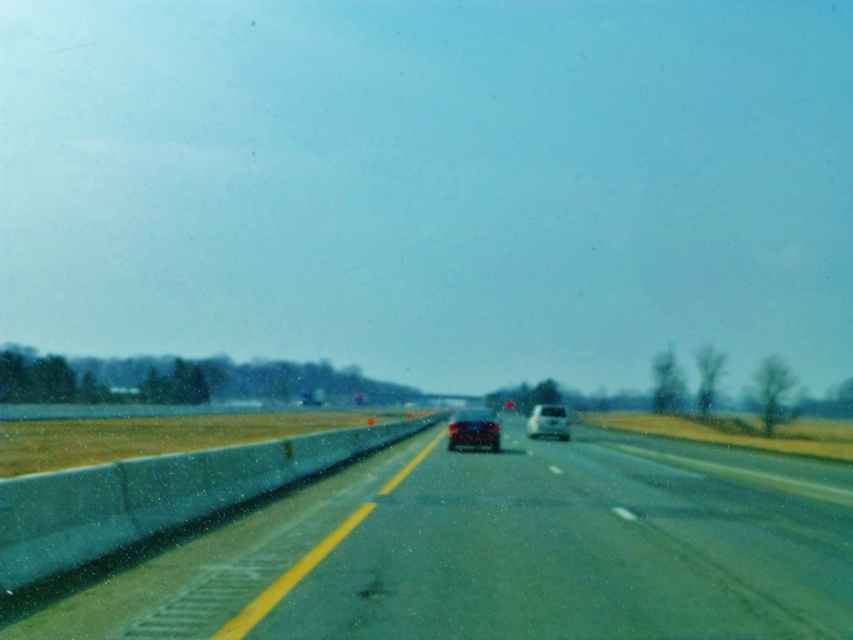
Does smooth asphalt road at center have a smaller size compared to shiny silver sedan at center?

No, smooth asphalt road at center is not smaller than shiny silver sedan at center.

Who is more forward, (749, 513) or (471, 433)?

Positioned in front is point (749, 513).

Locate an element on the screen. This screenshot has height=640, width=853. smooth asphalt road at center is located at coordinates (550, 548).

Is smooth asphalt road at center positioned in front of white glossy car at center?

Yes.

Who is positioned more to the right, smooth asphalt road at center or white glossy car at center?

white glossy car at center is more to the right.

Is point (689, 612) positioned in front of point (544, 406)?

Yes, point (689, 612) is in front of point (544, 406).

Where is `smooth asphalt road at center`? smooth asphalt road at center is located at coordinates (550, 548).

Which is behind, point (480, 436) or point (560, 424)?

The point (560, 424) is behind.

Can you confirm if shiny silver sedan at center is positioned to the right of white glossy car at center?

No, shiny silver sedan at center is not to the right of white glossy car at center.

Does point (486, 422) come closer to viewer compared to point (537, 432)?

Yes.

Identify the location of shiny silver sedan at center. (473, 428).